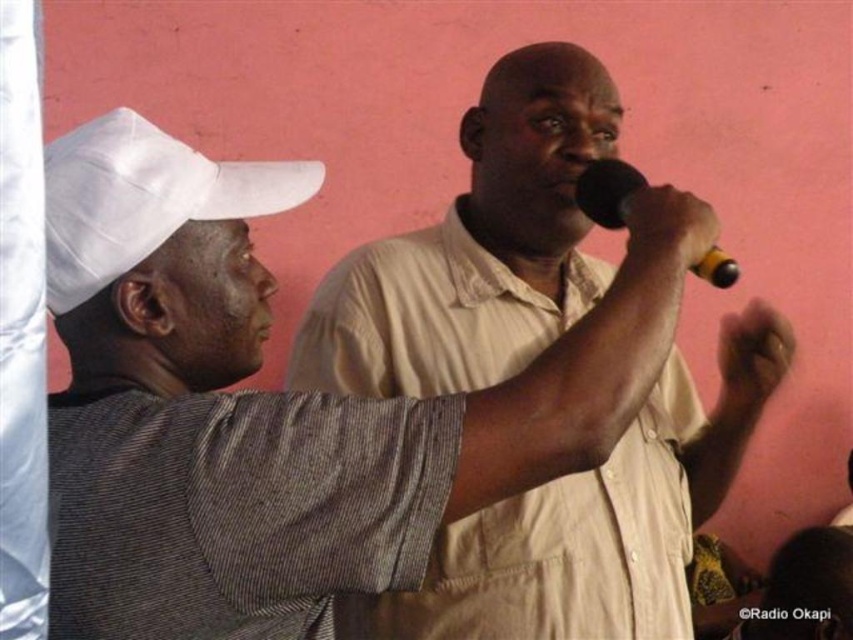
Can you confirm if white fabric cap at left is thinner than black plastic microphone at upper center?

No.

Where is `white fabric cap at left`? This screenshot has height=640, width=853. white fabric cap at left is located at coordinates 144,198.

Image resolution: width=853 pixels, height=640 pixels. What are the coordinates of `white fabric cap at left` in the screenshot? It's located at (144, 198).

Where is `beige striped shirt at center`? Image resolution: width=853 pixels, height=640 pixels. beige striped shirt at center is located at coordinates (476, 248).

From the picture: Who is lower down, beige striped shirt at center or white fabric cap at left?

beige striped shirt at center

Which is behind, point (386, 618) or point (91, 244)?

The point (386, 618) is more distant.

Where is `beige striped shirt at center`? beige striped shirt at center is located at coordinates (476, 248).

At what (x,y) coordinates should I click in order to perform the action: click on beige striped shirt at center. Please return your answer as a coordinate pair (x, y). The image size is (853, 640). Looking at the image, I should click on (476, 248).